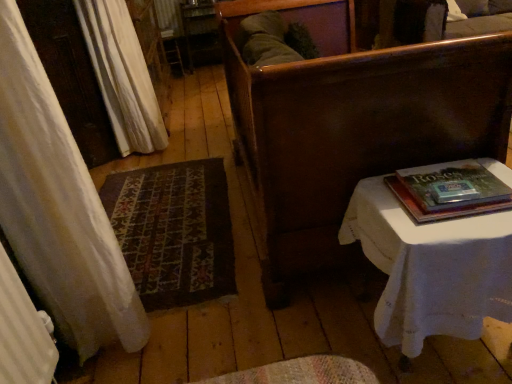
What do you see at coordinates (450, 192) in the screenshot? The height and width of the screenshot is (384, 512). I see `hardcover book at right` at bounding box center [450, 192].

In order to face dark brown wood bench at center, should I rotate leftwards or rightwards?

You should look right and rotate roughly 9.449 degrees.

What is the approximate height of dark brown wood bench at center?

dark brown wood bench at center is 38.30 inches tall.

The width and height of the screenshot is (512, 384). I want to click on hardcover book at right, so click(450, 192).

From the image's perspective, which one is positioned higher, white cloth-covered table at right or white fabric curtain at upper left?

white fabric curtain at upper left.

Which of these two, white cloth-covered table at right or white fabric curtain at upper left, is bigger?

With larger size is white fabric curtain at upper left.

Is white fabric curtain at upper left completely or partially inside white cloth-covered table at right?

Actually, white fabric curtain at upper left is outside white cloth-covered table at right.

Considering the sizes of objects white cloth-covered table at right and white fabric curtain at upper left in the image provided, who is thinner, white cloth-covered table at right or white fabric curtain at upper left?

With smaller width is white fabric curtain at upper left.

Is white fabric curtain at upper left positioned with its back to hardcover book at right?

No, white fabric curtain at upper left is not facing away from hardcover book at right.

Locate an element on the screen. The image size is (512, 384). paperback book located on the right of white fabric curtain at upper left is located at coordinates (450, 192).

Visually, is white fabric curtain at upper left positioned to the left or to the right of hardcover book at right?

In the image, white fabric curtain at upper left appears on the left side of hardcover book at right.

Looking at this image, can you confirm if white fabric curtain at upper left is thinner than hardcover book at right?

Indeed, white fabric curtain at upper left has a lesser width compared to hardcover book at right.

From a real-world perspective, is white cloth-covered table at right positioned above or below dark brown wood bench at center?

In terms of real-world spatial position, white cloth-covered table at right is below dark brown wood bench at center.

Which is correct: white cloth-covered table at right is inside dark brown wood bench at center, or outside of it?

white cloth-covered table at right exists outside the volume of dark brown wood bench at center.

Based on the photo, is white cloth-covered table at right oriented away from dark brown wood bench at center?

No, white cloth-covered table at right's orientation is not away from dark brown wood bench at center.

Looking at this image, which is behind, white cloth-covered table at right or dark brown wood bench at center?

dark brown wood bench at center is further away from the camera.

Is hardcover book at right oriented away from white cloth-covered table at right?

No.

Which is correct: hardcover book at right is inside white cloth-covered table at right, or outside of it?

hardcover book at right lies outside white cloth-covered table at right.

How far apart are hardcover book at right and white cloth-covered table at right?

hardcover book at right is 12.90 centimeters from white cloth-covered table at right.

From the image's perspective, is hardcover book at right above or below white cloth-covered table at right?

From the image's perspective, hardcover book at right appears above white cloth-covered table at right.

In the image, is hardcover book at right positioned in front of or behind dark brown wood bench at center?

Clearly, hardcover book at right is behind dark brown wood bench at center.

Is hardcover book at right taller or shorter than dark brown wood bench at center?

Clearly, hardcover book at right is shorter compared to dark brown wood bench at center.

Can you tell me how much hardcover book at right and dark brown wood bench at center differ in facing direction?

hardcover book at right and dark brown wood bench at center are facing 4.27 degrees away from each other.

What's the angular difference between white fabric curtain at upper left and white cloth-covered table at right's facing directions?

There is a 1.02-degree angle between the facing directions of white fabric curtain at upper left and white cloth-covered table at right.

From the image's perspective, is white fabric curtain at upper left located above white cloth-covered table at right?

Yes, from the image's perspective, white fabric curtain at upper left is above white cloth-covered table at right.

Does white fabric curtain at upper left appear on the left side of white cloth-covered table at right?

Yes.

Looking at this image, measure the distance between white fabric curtain at upper left and white cloth-covered table at right.

white fabric curtain at upper left and white cloth-covered table at right are 7.05 feet apart from each other.

Does white fabric curtain at upper left turn towards dark brown wood bench at center?

No, white fabric curtain at upper left is not facing towards dark brown wood bench at center.

Which object is more forward, white fabric curtain at upper left or dark brown wood bench at center?

dark brown wood bench at center is closer to the camera.

Is white fabric curtain at upper left far away from dark brown wood bench at center?

Indeed, white fabric curtain at upper left is not near dark brown wood bench at center.

Find the location of `curtain above the white cloth-covered table at right (from a real-world perspective)`. curtain above the white cloth-covered table at right (from a real-world perspective) is located at coordinates (122, 76).

This screenshot has height=384, width=512. In order to click on curtain that is above the hardcover book at right (from the image's perspective) in this screenshot , I will do `click(122, 76)`.

Considering their positions, is white cloth-covered table at right positioned further to hardcover book at right than dark brown wood bench at center?

The object further to hardcover book at right is dark brown wood bench at center.

Based on their spatial positions, is hardcover book at right or dark brown wood bench at center further from white cloth-covered table at right?

dark brown wood bench at center lies further to white cloth-covered table at right than the other object.

Which object lies nearer to the anchor point dark brown wood bench at center, white fabric curtain at upper left or white cloth-covered table at right?

white cloth-covered table at right lies closer to dark brown wood bench at center than the other object.

From the image, which object appears to be nearer to white fabric curtain at upper left, dark brown wood bench at center or hardcover book at right?

dark brown wood bench at center is closer to white fabric curtain at upper left.

When comparing their distances from white cloth-covered table at right, does dark brown wood bench at center or hardcover book at right seem further?

Answer: Among the two, dark brown wood bench at center is located further to white cloth-covered table at right.

From the image, which object appears to be farther from hardcover book at right, white fabric curtain at upper left or dark brown wood bench at center?

white fabric curtain at upper left lies further to hardcover book at right than the other object.

Based on their spatial positions, is dark brown wood bench at center or white cloth-covered table at right further from white fabric curtain at upper left?

white cloth-covered table at right is further to white fabric curtain at upper left.

Which object lies nearer to the anchor point dark brown wood bench at center, hardcover book at right or white fabric curtain at upper left?

hardcover book at right is closer to dark brown wood bench at center.

What are the coordinates of `paperback book between dark brown wood bench at center and white cloth-covered table at right vertically` in the screenshot? It's located at (x=450, y=192).

What are the coordinates of `paperback book between white cloth-covered table at right and white fabric curtain at upper left from front to back` in the screenshot? It's located at (450, 192).

Identify the location of paperback book between dark brown wood bench at center and white fabric curtain at upper left along the z-axis. The width and height of the screenshot is (512, 384). (450, 192).

In order to click on furniture between white cloth-covered table at right and white fabric curtain at upper left in the front-back direction in this screenshot , I will do `click(351, 125)`.